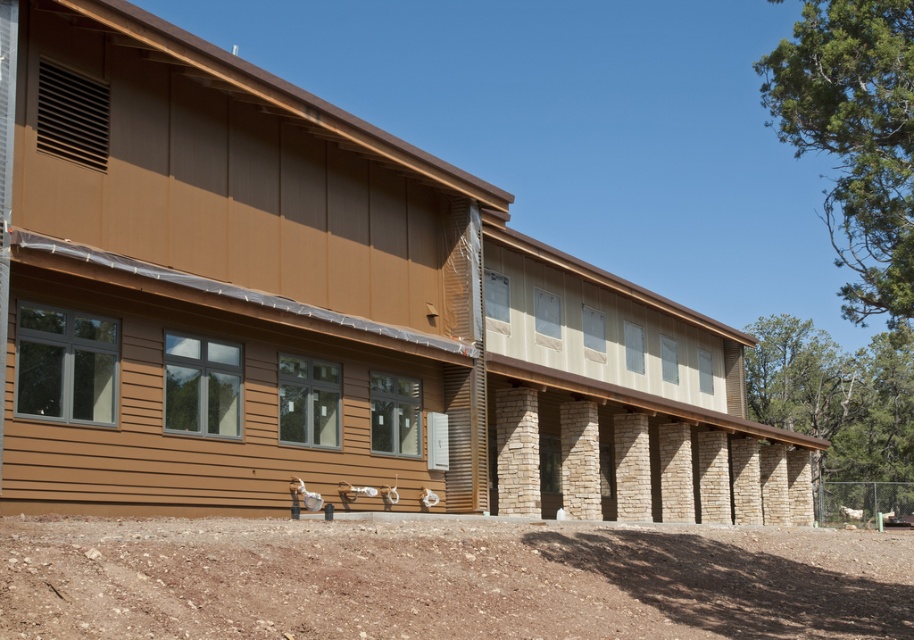
You are a construction worker standing at the base of the building. You notice two points marked on the building exterior. The first point is at coordinate point(601, 368) and the second is at point(849, 580). Which point is closer to the ground level?

Point(849, 580) is closer to the ground level because it is in front of point(601, 368), which is behind it.

You are a construction worker standing on the ground floor of the building. You need to place a heavy equipment box on the ground near the brown gravel at lower center. However, there is a vent located near the brown wood siding at center. Where should you place the box to avoid blocking the vent?

The brown wood siding at center is positioned over brown gravel at lower center. Therefore, the vent is near the brown wood siding at center, which is above the brown gravel at lower center. To avoid blocking the vent, place the box on the brown gravel at lower center below the vent.

You are a contractor assessing the exterior of the building. You notice the brown wood siding at center and the brown gravel at lower center. Which material would you estimate covers a greater area on the building facade?

The brown wood siding at center has a larger size compared to brown gravel at lower center, so it covers a greater area on the building facade.